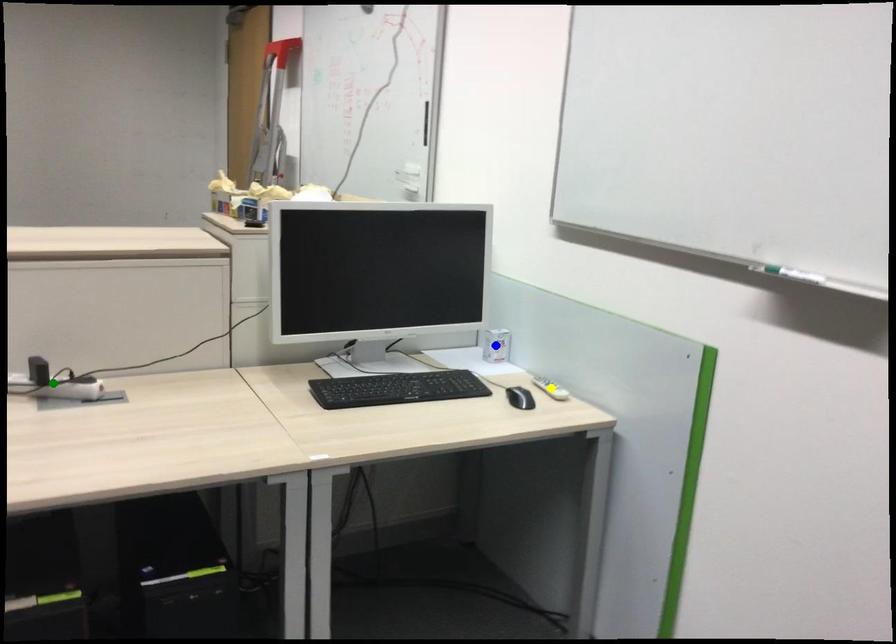
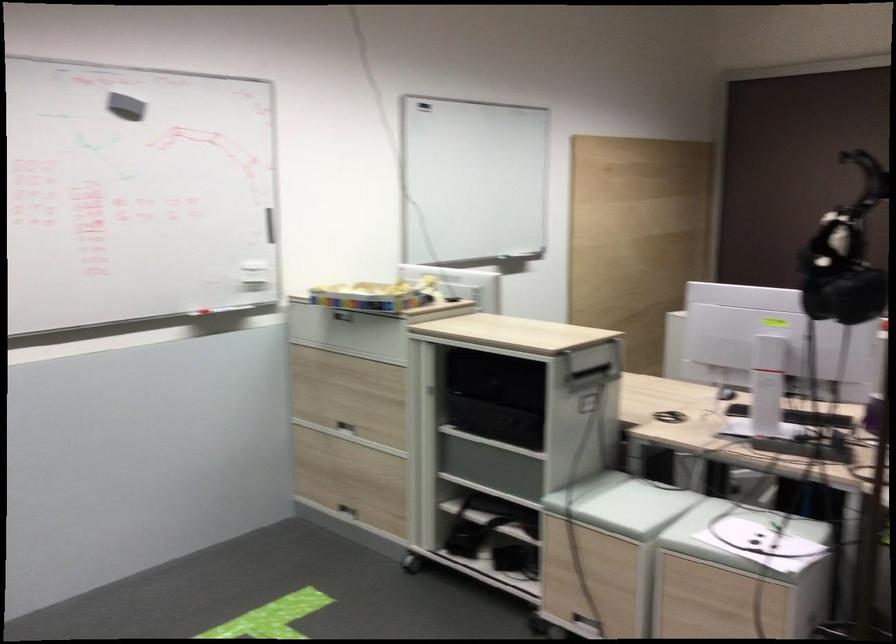
I am providing you with two images of the same scene from different viewpoints. Three points are marked in image1. Which point corresponds to a part or object that is occluded in image2?In image1, three points are marked. Which of them correspond to a part or object that is occluded in image2?Among the three points shown in image1, which one corresponds to a part or object that is no longer visible due to occlusion in image2?

yellow point, green point, blue point